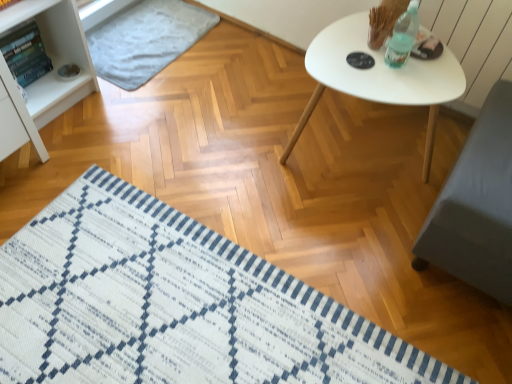
Question: From a real-world perspective, is light gray textured mat at upper left, the second mat positioned from the bottom, beneath white matte table at upper right?

Choices:
 (A) no
 (B) yes

Answer: (B)

Question: Is light gray textured mat at upper left, the second mat positioned from the bottom, not inside white matte table at upper right?

Choices:
 (A) yes
 (B) no

Answer: (A)

Question: Considering the relative sizes of light gray textured mat at upper left, acting as the first mat starting from the back, and white matte table at upper right in the image provided, is light gray textured mat at upper left, acting as the first mat starting from the back, shorter than white matte table at upper right?

Choices:
 (A) yes
 (B) no

Answer: (A)

Question: Are light gray textured mat at upper left, positioned as the 1th mat in top-to-bottom order, and white matte table at upper right far apart?

Choices:
 (A) yes
 (B) no

Answer: (A)

Question: Considering the relative sizes of light gray textured mat at upper left, the second mat positioned from the bottom, and white matte table at upper right in the image provided, is light gray textured mat at upper left, the second mat positioned from the bottom, taller than white matte table at upper right?

Choices:
 (A) yes
 (B) no

Answer: (B)

Question: From the image's perspective, does light gray textured mat at upper left, the 2th mat viewed from the front, appear lower than white matte table at upper right?

Choices:
 (A) yes
 (B) no

Answer: (B)

Question: Is the position of white matte table at upper right less distant than that of light gray textured mat at upper left, the second mat positioned from the bottom?

Choices:
 (A) yes
 (B) no

Answer: (A)

Question: Is white matte table at upper right at the left side of light gray textured mat at upper left, acting as the first mat starting from the back?

Choices:
 (A) no
 (B) yes

Answer: (A)

Question: Is white matte table at upper right not close to light gray textured mat at upper left, the second mat positioned from the bottom?

Choices:
 (A) no
 (B) yes

Answer: (B)

Question: From a real-world perspective, is white matte table at upper right positioned under light gray textured mat at upper left, the 2th mat viewed from the front, based on gravity?

Choices:
 (A) no
 (B) yes

Answer: (A)

Question: From a real-world perspective, is white matte table at upper right on light gray textured mat at upper left, the second mat positioned from the bottom?

Choices:
 (A) no
 (B) yes

Answer: (B)

Question: Is white matte table at upper right not inside light gray textured mat at upper left, acting as the first mat starting from the back?

Choices:
 (A) yes
 (B) no

Answer: (A)

Question: Is white woven mat at lower left, the first mat when ordered from front to back, smaller than white matte table at upper right?

Choices:
 (A) yes
 (B) no

Answer: (A)